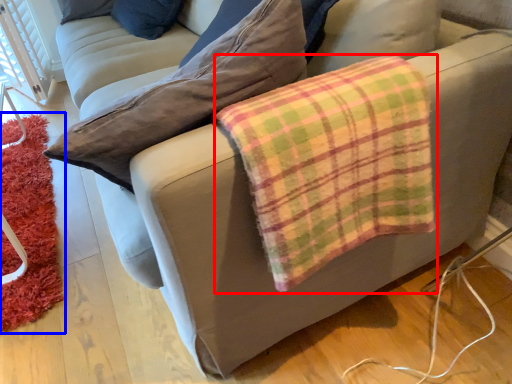
Question: Which of the following is the closest to the observer, flannel (highlighted by a red box) or mat (highlighted by a blue box)?

Choices:
 (A) flannel
 (B) mat

Answer: (A)